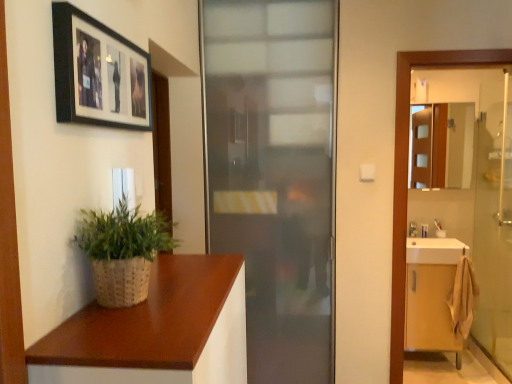
Measure the distance between brown wood countertop at lower left and camera.

Answer: The depth of brown wood countertop at lower left is 76.62 centimeters.

The height and width of the screenshot is (384, 512). What do you see at coordinates (442, 146) in the screenshot?
I see `wooden cabinet at right` at bounding box center [442, 146].

What do you see at coordinates (435, 251) in the screenshot? This screenshot has height=384, width=512. I see `white glossy sink at right` at bounding box center [435, 251].

This screenshot has height=384, width=512. Describe the element at coordinates (494, 221) in the screenshot. I see `clear glass screen door at right` at that location.

The image size is (512, 384). In order to click on light wood cabinet at right in this screenshot , I will do pyautogui.click(x=430, y=310).

Where is `brown wood countertop at lower left`? This screenshot has height=384, width=512. brown wood countertop at lower left is located at coordinates (156, 331).

Does point (510, 199) come in front of point (438, 138)?

Yes, it is in front of point (438, 138).

Is the position of clear glass screen door at right more distant than that of wooden cabinet at right?

That is False.

In the scene shown: Could you tell me if clear glass screen door at right is turned towards wooden cabinet at right?

Yes, clear glass screen door at right is aimed at wooden cabinet at right.

From a real-world perspective, between clear glass screen door at right and wooden cabinet at right, who is vertically lower?

In real-world perspective, clear glass screen door at right is lower.

Is the surface of woven natural plant at lower left in direct contact with light wood cabinet at right?

They are not placed beside each other.

Which object is positioned more to the left, woven natural plant at lower left or light wood cabinet at right?

Positioned to the left is woven natural plant at lower left.

Based on the photo, does woven natural plant at lower left contain light wood cabinet at right?

No.

Which of these two, woven natural plant at lower left or light wood cabinet at right, stands shorter?

Standing shorter between the two is woven natural plant at lower left.

Who is more distant, light wood cabinet at right or transparent glass elevator at right?

light wood cabinet at right is further from the camera.

Based on the photo, from a real-world perspective, which is physically below, light wood cabinet at right or transparent glass elevator at right?

light wood cabinet at right is physically lower.

Does light wood cabinet at right turn towards transparent glass elevator at right?

Yes.

I want to click on elevator in front of the light wood cabinet at right, so click(x=407, y=172).

Is frosted glass door at center taller than light wood cabinet at right?

Correct, frosted glass door at center is much taller as light wood cabinet at right.

How different are the orientations of frosted glass door at center and light wood cabinet at right in degrees?

The angular difference between frosted glass door at center and light wood cabinet at right is 0.000105 degrees.

Which is correct: frosted glass door at center is inside light wood cabinet at right, or outside of it?

frosted glass door at center is not inside light wood cabinet at right, it's outside.

Is frosted glass door at center further to the viewer compared to light wood cabinet at right?

No, frosted glass door at center is closer to the viewer.

Considering the sizes of objects white glossy sink at right and clear glass screen door at right in the image provided, who is shorter, white glossy sink at right or clear glass screen door at right?

white glossy sink at right is shorter.

Is white glossy sink at right with clear glass screen door at right?

white glossy sink at right and clear glass screen door at right are not in contact.

How distant is white glossy sink at right from clear glass screen door at right?

They are 25.18 inches apart.

Which object is further away from the camera taking this photo, white glossy sink at right or clear glass screen door at right?

white glossy sink at right is behind.

From the picture: Does transparent glass elevator at right lie behind brown wood countertop at lower left?

Yes, it is behind brown wood countertop at lower left.

From a real-world perspective, does transparent glass elevator at right stand above brown wood countertop at lower left?

Indeed, from a real-world perspective, transparent glass elevator at right stands above brown wood countertop at lower left.

Which is correct: transparent glass elevator at right is inside brown wood countertop at lower left, or outside of it?

transparent glass elevator at right is not enclosed by brown wood countertop at lower left.

Which is more to the right, transparent glass elevator at right or brown wood countertop at lower left?

From the viewer's perspective, transparent glass elevator at right appears more on the right side.

From a real-world perspective, is wooden cabinet at right beneath clear glass screen door at right?

No, from a real-world perspective, wooden cabinet at right is not below clear glass screen door at right.

Is the position of wooden cabinet at right less distant than that of clear glass screen door at right?

No, it is behind clear glass screen door at right.

Which is more to the left, wooden cabinet at right or clear glass screen door at right?

Positioned to the left is wooden cabinet at right.

Locate an element on the screen. mirror located above the clear glass screen door at right (from the image's perspective) is located at coordinates (442, 146).

This screenshot has width=512, height=384. What are the coordinates of `mirror behind the clear glass screen door at right` in the screenshot? It's located at (442, 146).

Identify the location of houseplant to the left of light wood cabinet at right. The height and width of the screenshot is (384, 512). (122, 251).

Considering their positions, is frosted glass door at center positioned further to light wood cabinet at right than transparent glass elevator at right?

frosted glass door at center lies further to light wood cabinet at right than the other object.

From the picture: When comparing their distances from light wood cabinet at right, does frosted glass door at center or white glossy sink at right seem closer?

Among the two, white glossy sink at right is located nearer to light wood cabinet at right.

Looking at this image, based on their spatial positions, is brown wood countertop at lower left or woven natural plant at lower left closer to light wood cabinet at right?

Among the two, brown wood countertop at lower left is located nearer to light wood cabinet at right.

Considering their positions, is frosted glass door at center positioned further to clear glass screen door at right than wooden cabinet at right?

frosted glass door at center.

Considering their positions, is wooden cabinet at right positioned further to transparent glass elevator at right than black matte picture frame at upper left?

wooden cabinet at right is further to transparent glass elevator at right.

Considering their positions, is brown wood countertop at lower left positioned further to transparent glass elevator at right than wooden cabinet at right?

Based on the image, wooden cabinet at right appears to be further to transparent glass elevator at right.

Which object lies nearer to the anchor point frosted glass door at center, brown wood countertop at lower left or white glossy sink at right?

brown wood countertop at lower left.

Which object lies nearer to the anchor point wooden cabinet at right, transparent glass elevator at right or black matte picture frame at upper left?

The object closer to wooden cabinet at right is transparent glass elevator at right.

This screenshot has height=384, width=512. I want to click on sink located between woven natural plant at lower left and wooden cabinet at right in the depth direction, so click(x=435, y=251).

Find the location of a particular element. This screenshot has height=384, width=512. door between black matte picture frame at upper left and transparent glass elevator at right in the horizontal direction is located at coordinates (274, 174).

This screenshot has width=512, height=384. Find the location of `cabinetry positioned between black matte picture frame at upper left and wooden cabinet at right from near to far`. cabinetry positioned between black matte picture frame at upper left and wooden cabinet at right from near to far is located at coordinates (430, 310).

Locate an element on the screen. The image size is (512, 384). screen door between woven natural plant at lower left and wooden cabinet at right along the z-axis is located at coordinates (494, 221).